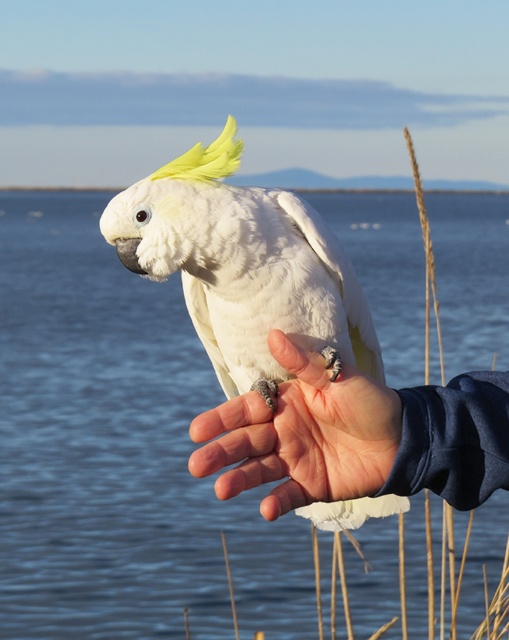
Is transparent blue water at center further to camera compared to white feathered parrot at center?

That is True.

Is transparent blue water at center shorter than white feathered parrot at center?

No, transparent blue water at center is not shorter than white feathered parrot at center.

Which is behind, point (173, 420) or point (261, 193)?

The point (173, 420) is more distant.

Find the location of `transparent blue water at center`. transparent blue water at center is located at coordinates (118, 452).

Between white feathered parrot at center and smooth skin palm at center, which one is positioned higher?

white feathered parrot at center is higher up.

Which is more to the left, white feathered parrot at center or smooth skin palm at center?

From the viewer's perspective, white feathered parrot at center appears more on the left side.

Is point (291, 204) positioned in front of point (313, 483)?

That is False.

In order to click on white feathered parrot at center in this screenshot , I will do `click(243, 266)`.

Locate an element on the screen. transparent blue water at center is located at coordinates (118, 452).

What do you see at coordinates (118, 452) in the screenshot? I see `transparent blue water at center` at bounding box center [118, 452].

At what (x,y) coordinates should I click in order to perform the action: click on transparent blue water at center. Please return your answer as a coordinate pair (x, y). Looking at the image, I should click on (118, 452).